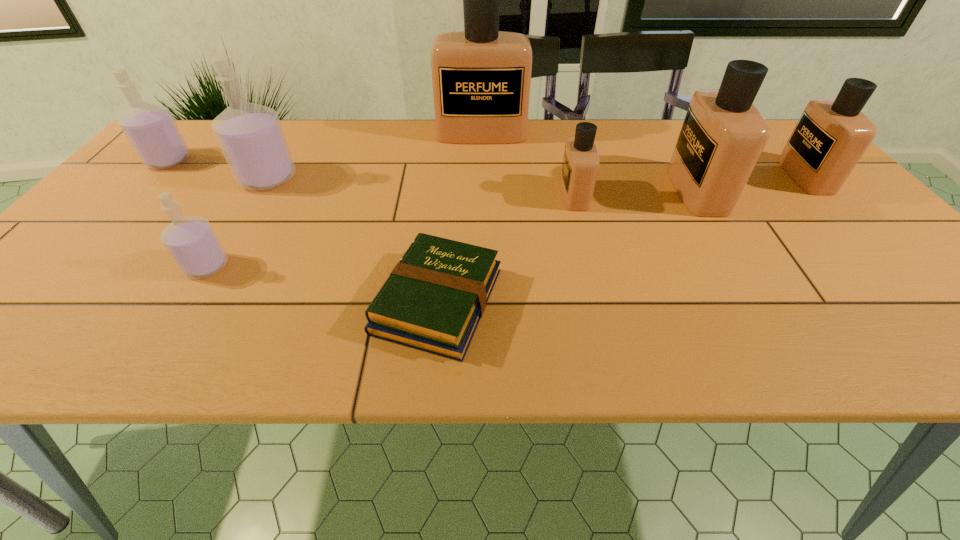
Where is `perfume identified as the second closest to the smallest purple perfume`? The height and width of the screenshot is (540, 960). perfume identified as the second closest to the smallest purple perfume is located at coordinates (150, 129).

Where is `the third closest perfume to the shortest object`? The width and height of the screenshot is (960, 540). the third closest perfume to the shortest object is located at coordinates pos(251,137).

Find the location of a particular element. Image resolution: width=960 pixels, height=540 pixels. beige perfume that is the third closest to the rightmost object is located at coordinates (481, 77).

Where is `beige perfume identified as the second closest to the biggest purple perfume`? beige perfume identified as the second closest to the biggest purple perfume is located at coordinates (580, 166).

Find the location of a particular element. The width and height of the screenshot is (960, 540). the second closest purple perfume to the biggest purple perfume is located at coordinates (192, 243).

Locate an element on the screen. The width and height of the screenshot is (960, 540). the closest purple perfume to the nearest perfume is located at coordinates (251, 137).

Find the location of a particular element. The height and width of the screenshot is (540, 960). vacant position in the image that satisfies the following two spatial constraints: 1. on the back side of the nearest perfume; 2. on the right side of the biggest purple perfume is located at coordinates (260, 178).